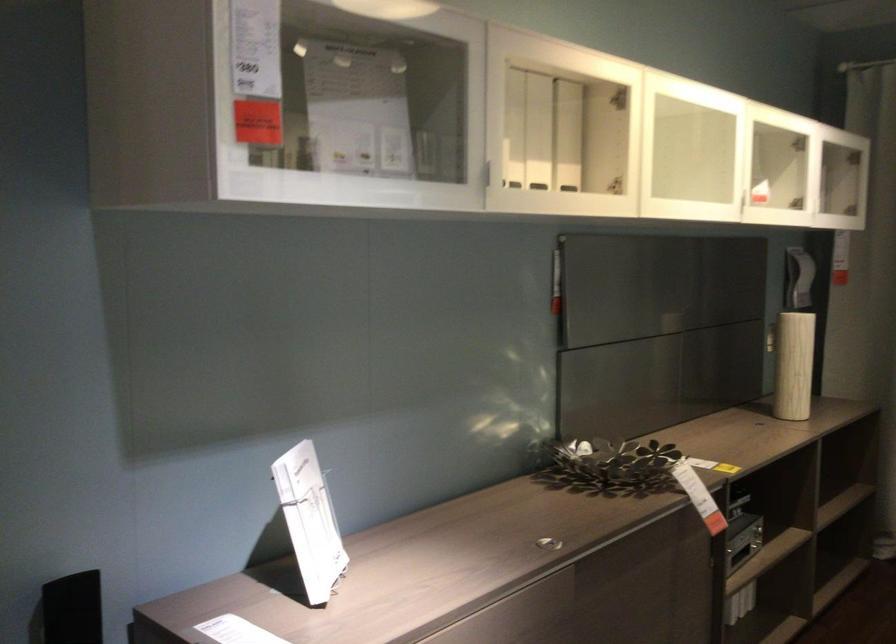
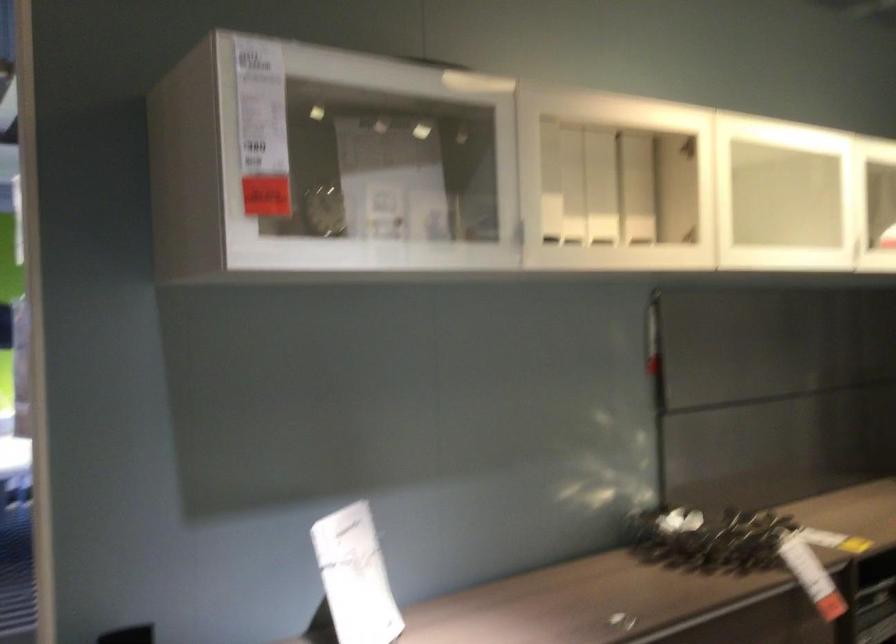
In the second image, find the point that corresponds to point 543,131 in the first image.

(600, 187)